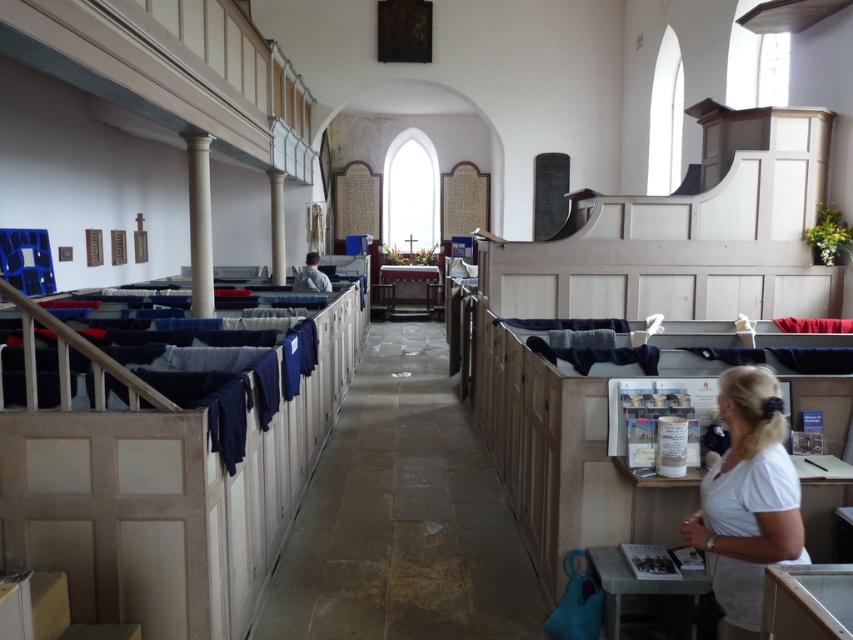
Question: Is white polished column at center further to camera compared to light blue fabric at center?

Choices:
 (A) yes
 (B) no

Answer: (A)

Question: Which object is positioned farthest from the white polished column at center?

Choices:
 (A) white smooth column at left
 (B) light blue fabric at center

Answer: (A)

Question: Can you confirm if white cotton shirt at lower right is bigger than white smooth column at left?

Choices:
 (A) no
 (B) yes

Answer: (A)

Question: Which point is farther to the camera?

Choices:
 (A) (274, 250)
 (B) (740, 605)

Answer: (A)

Question: Can you confirm if white polished column at center is positioned to the left of light blue fabric at center?

Choices:
 (A) no
 (B) yes

Answer: (B)

Question: Among these objects, which one is nearest to the camera?

Choices:
 (A) light blue fabric at center
 (B) white smooth column at left
 (C) white cotton shirt at lower right
 (D) white polished column at center

Answer: (C)